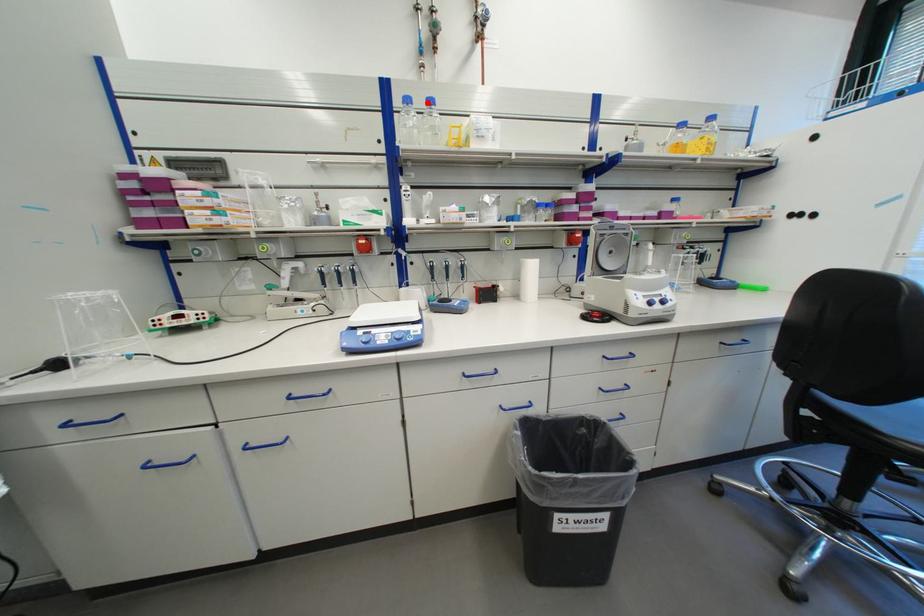
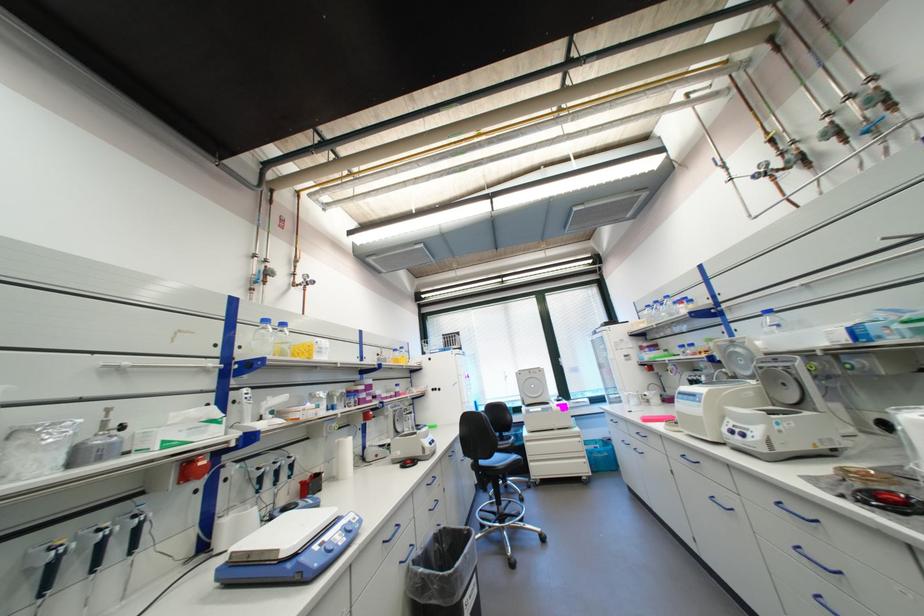
In the second image, find the point that corresponds to the highlighted location in the first image.

(283, 323)